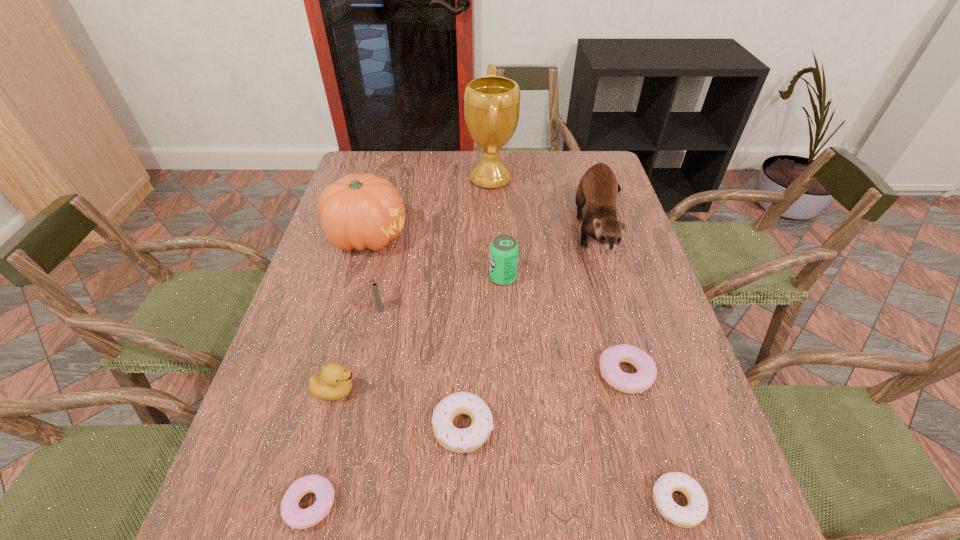
I want to click on the tallest object, so click(492, 103).

Locate an element on the screen. Image resolution: width=960 pixels, height=540 pixels. pumpkin is located at coordinates (357, 211).

The image size is (960, 540). I want to click on ferret, so [x=597, y=190].

At what (x,y) coordinates should I click in order to perform the action: click on the fourth tallest object. Please return your answer as a coordinate pair (x, y). This screenshot has width=960, height=540. Looking at the image, I should click on tap(503, 250).

This screenshot has width=960, height=540. What are the coordinates of `igniter` in the screenshot? It's located at (374, 286).

Where is `duckling`? duckling is located at coordinates (334, 382).

Identify the location of the bigger white doughnut. (456, 440).

Find the location of `the left white doughnut`. the left white doughnut is located at coordinates (456, 440).

In order to click on the farthest doughnut in this screenshot , I will do `click(609, 360)`.

Identify the location of the farther pink doughnut. The image size is (960, 540). (609, 360).